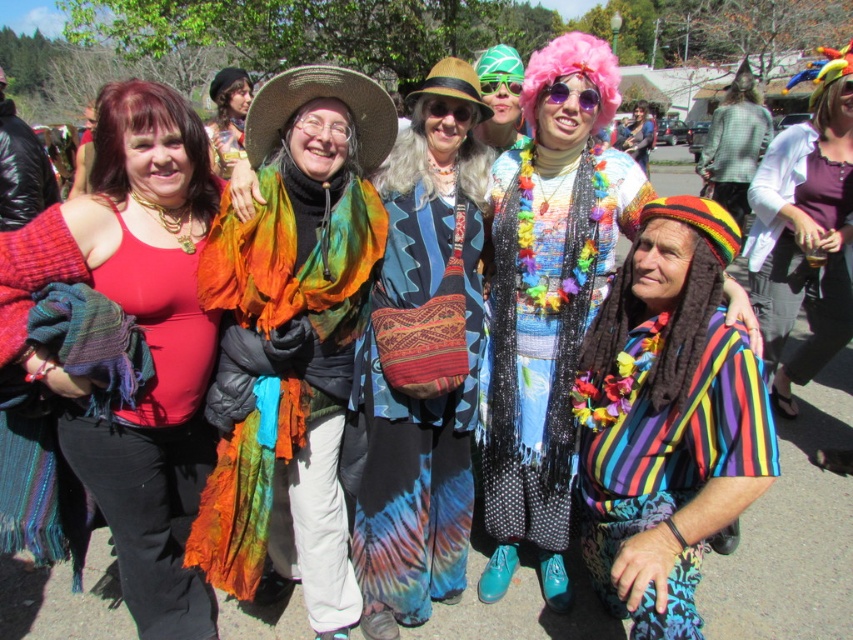
Can you confirm if white knit cardigan at center is positioned above multicolored fabric wig at center?

Actually, white knit cardigan at center is below multicolored fabric wig at center.

Based on the photo, can you confirm if white knit cardigan at center is positioned to the left of multicolored fabric wig at center?

Incorrect, white knit cardigan at center is not on the left side of multicolored fabric wig at center.

Who is more forward, [838,170] or [239,104]?

Positioned in front is point [838,170].

Find the location of a particular element. The width and height of the screenshot is (853, 640). white knit cardigan at center is located at coordinates (805, 230).

Is point (512, 256) closer to camera compared to point (310, 116)?

No, (512, 256) is further to viewer.

Between multicolored fabric dress at center and rainbow fabric wig at center, which one is positioned lower?

rainbow fabric wig at center is below.

Is point (608, 104) closer to viewer compared to point (331, 102)?

No, (608, 104) is behind (331, 102).

Where is `multicolored fabric dress at center`? This screenshot has width=853, height=640. multicolored fabric dress at center is located at coordinates (547, 298).

Is point (614, 292) closer to viewer compared to point (424, 544)?

Yes, it is.

Is rainbow striped shirt at center to the right of tie-dye fabric dress at center from the viewer's perspective?

Correct, you'll find rainbow striped shirt at center to the right of tie-dye fabric dress at center.

Does point (642, 237) lie behind point (419, 563)?

No, it is not.

Where is `rainbow striped shirt at center`? This screenshot has width=853, height=640. rainbow striped shirt at center is located at coordinates (666, 419).